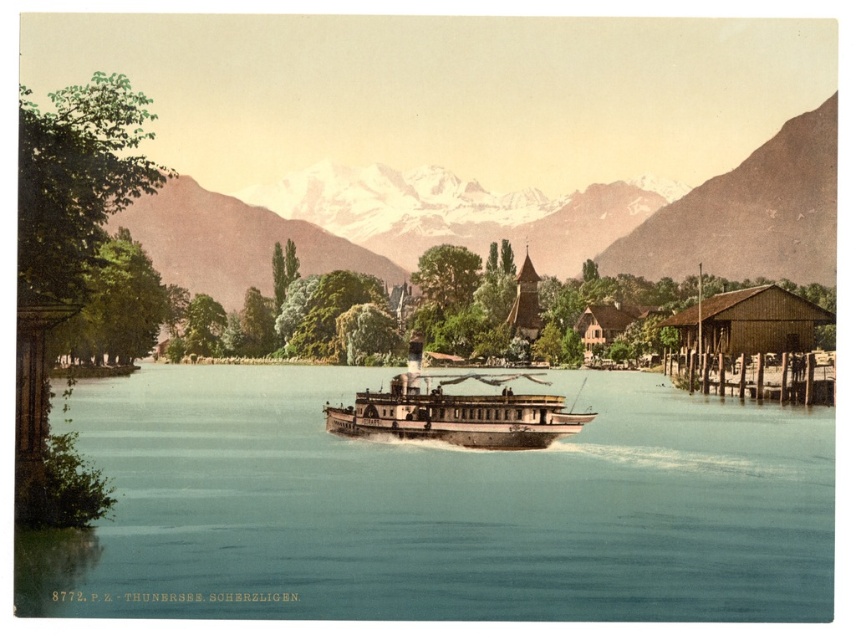
Question: Is blue water at center smaller than wooden polished boat at center?

Choices:
 (A) yes
 (B) no

Answer: (B)

Question: Where is blue water at center located in relation to snowy mountain at upper center in the image?

Choices:
 (A) left
 (B) right

Answer: (A)

Question: Which point is closer to the camera?

Choices:
 (A) (333, 440)
 (B) (547, 428)
 (C) (607, 196)

Answer: (B)

Question: Does blue water at center appear over snowy mountain at upper center?

Choices:
 (A) no
 (B) yes

Answer: (A)

Question: Considering the real-world distances, which object is farthest from the blue water at center?

Choices:
 (A) wooden polished boat at center
 (B) snowy mountain at upper center

Answer: (B)

Question: Which object is closer to the camera taking this photo?

Choices:
 (A) blue water at center
 (B) wooden polished boat at center
 (C) snowy mountain at upper center

Answer: (A)